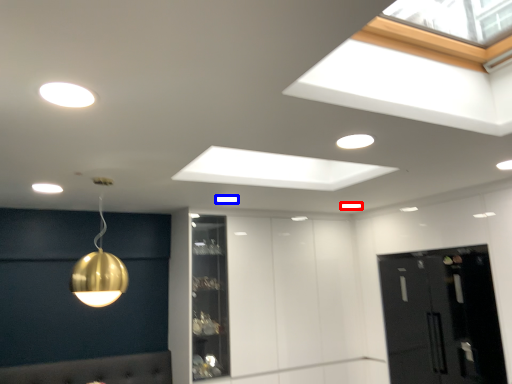
Question: Which point is further to the camera, lamp (highlighted by a red box) or lamp (highlighted by a blue box)?

Choices:
 (A) lamp
 (B) lamp

Answer: (A)